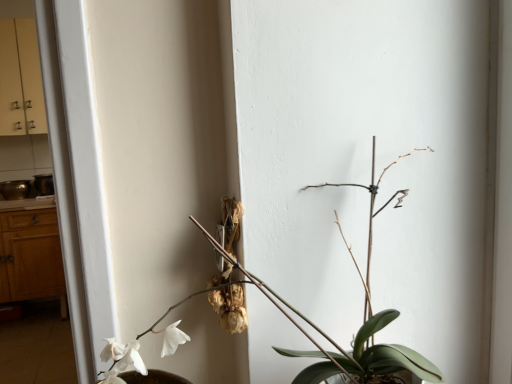
This screenshot has height=384, width=512. What do you see at coordinates (28, 204) in the screenshot?
I see `wooden counter top at left` at bounding box center [28, 204].

Measure the distance between point (170, 346) and camera.

Point (170, 346) and camera are 27.24 inches apart from each other.

Image resolution: width=512 pixels, height=384 pixels. Describe the element at coordinates (31, 256) in the screenshot. I see `wooden dresser at left` at that location.

Identify the location of wooden counter top at left. (28, 204).

Does wooden dresser at left turn towards wooden counter top at left?

No.

Is wooden dresser at left further to camera compared to wooden counter top at left?

No, wooden dresser at left is closer to the viewer.

In the image, is wooden dresser at left on the left side or the right side of wooden counter top at left?

Based on their positions, wooden dresser at left is located to the right of wooden counter top at left.

From the picture: Is wooden dresser at left completely or partially outside of wooden counter top at left?

Indeed, wooden dresser at left is completely outside wooden counter top at left.

In terms of height, does wooden counter top at left look taller or shorter compared to wooden dresser at left?

Clearly, wooden counter top at left is shorter compared to wooden dresser at left.

Is wooden dresser at left surrounded by wooden counter top at left?

Actually, wooden dresser at left is outside wooden counter top at left.

Who is smaller, wooden counter top at left or wooden dresser at left?

wooden counter top at left.

From a real-world perspective, who is located higher, wooden counter top at left or wooden dresser at left?

In real-world perspective, wooden counter top at left is above.

Could you tell me if green matte plant at center is facing wooden counter top at left?

No, green matte plant at center does not turn towards wooden counter top at left.

Which point is more forward, (435, 370) or (42, 203)?

The point (435, 370) is more forward.

Is wooden counter top at left a part of green matte plant at center?

That's incorrect, wooden counter top at left is not inside green matte plant at center.

Between green matte plant at center and wooden dresser at left, which one has larger size?

wooden dresser at left is bigger.

From the image's perspective, would you say green matte plant at center is positioned over wooden dresser at left?

Yes, from the image's perspective, green matte plant at center is on top of wooden dresser at left.

Would you say green matte plant at center is to the left or to the right of wooden dresser at left in the picture?

Clearly, green matte plant at center is on the right of wooden dresser at left in the image.

Is green matte plant at center not inside wooden dresser at left?

That's correct, green matte plant at center is outside of wooden dresser at left.

Does wooden counter top at left appear on the left side of green matte plant at center?

Yes.

Which object is further away from the camera taking this photo, wooden counter top at left or green matte plant at center?

wooden counter top at left is more distant.

Is wooden counter top at left turned away from green matte plant at center?

No, wooden counter top at left is not facing the opposite direction of green matte plant at center.

From the image's perspective, would you say wooden counter top at left is positioned over green matte plant at center?

Correct, wooden counter top at left appears higher than green matte plant at center in the image.

Consider the image. Between wooden dresser at left and green matte plant at center, which one is positioned behind?

wooden dresser at left.

Based on the photo, from the image's perspective, does wooden dresser at left appear higher than green matte plant at center?

No, from the image's perspective, wooden dresser at left is not above green matte plant at center.

From the picture: Measure the distance from wooden dresser at left to green matte plant at center.

They are 7.58 feet apart.

In the scene shown: Considering the sizes of objects wooden dresser at left and green matte plant at center in the image provided, who is bigger, wooden dresser at left or green matte plant at center?

wooden dresser at left.

I want to click on counter top on the left of wooden dresser at left, so click(x=28, y=204).

You are a GUI agent. You are given a task and a screenshot of the screen. Output one action in this format:
    pyautogui.click(x=<x>, y=<y>)
    Task: Click on the counter top above the wooden dresser at left (from a real-world perspective)
    This screenshot has height=384, width=512.
    Given the screenshot: What is the action you would take?
    pyautogui.click(x=28, y=204)

Estimate the real-world distances between objects in this image. Which object is closer to wooden dresser at left, green matte plant at center or wooden counter top at left?

Among the two, wooden counter top at left is located nearer to wooden dresser at left.

Which object lies nearer to the anchor point wooden counter top at left, wooden dresser at left or green matte plant at center?

Among the two, wooden dresser at left is located nearer to wooden counter top at left.

Considering their positions, is wooden dresser at left positioned further to green matte plant at center than wooden counter top at left?

Based on the image, wooden counter top at left appears to be further to green matte plant at center.

Based on their spatial positions, is wooden counter top at left or wooden dresser at left further from green matte plant at center?

Among the two, wooden counter top at left is located further to green matte plant at center.

Estimate the real-world distances between objects in this image. Which object is further from wooden dresser at left, wooden counter top at left or green matte plant at center?

green matte plant at center is positioned further to the anchor wooden dresser at left.

Estimate the real-world distances between objects in this image. Which object is closer to wooden counter top at left, green matte plant at center or wooden dresser at left?

Based on the image, wooden dresser at left appears to be nearer to wooden counter top at left.

Find the location of a particular element. This screenshot has width=512, height=384. dresser positioned between green matte plant at center and wooden counter top at left from near to far is located at coordinates (31, 256).